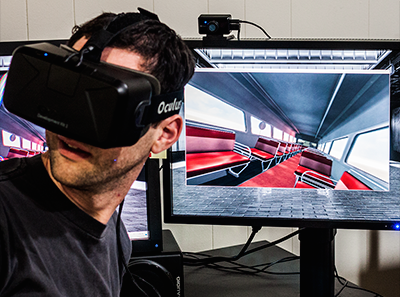
The width and height of the screenshot is (400, 297). What are the coordinates of `computer monitors` in the screenshot? It's located at (327, 91), (152, 217).